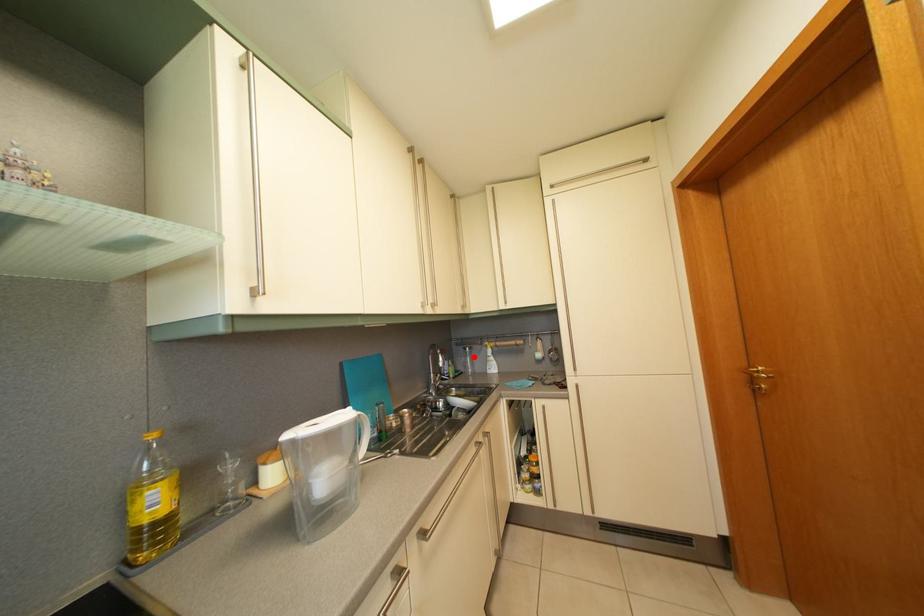
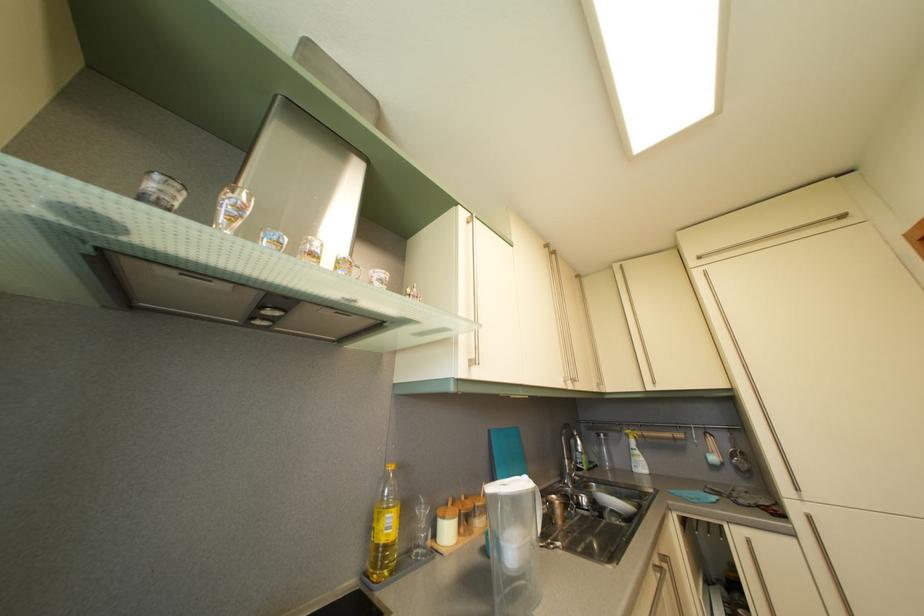
Where in the second image is the point corresponding to the highlighted location from the first image?

(608, 444)